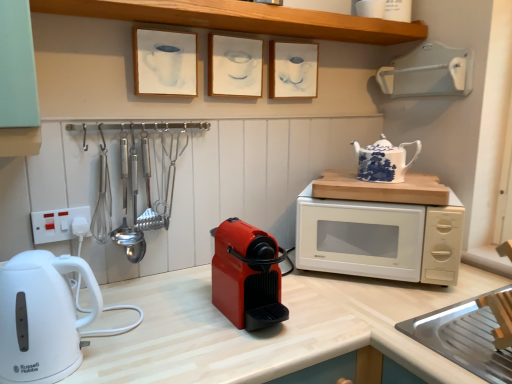
Find the location of a particular element. blank space above matte plastic coffee machine at center, which is the first home appliance in right-to-left order (from a real-world perspective) is located at coordinates (242, 226).